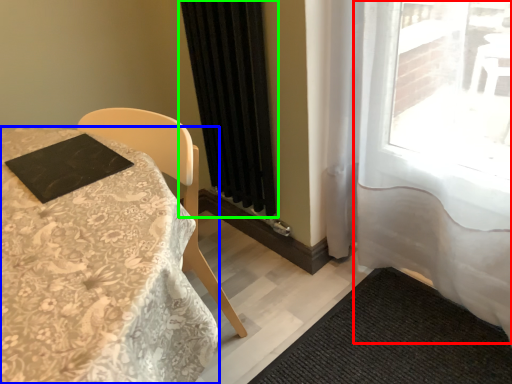
Question: Which object is positioned closest to curtain (highlighted by a red box)? Select from table (highlighted by a blue box) and curtain (highlighted by a green box).

Choices:
 (A) table
 (B) curtain

Answer: (B)